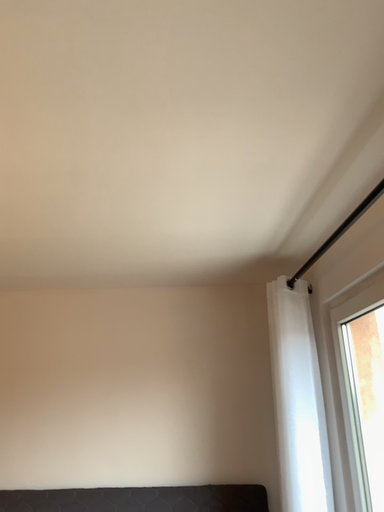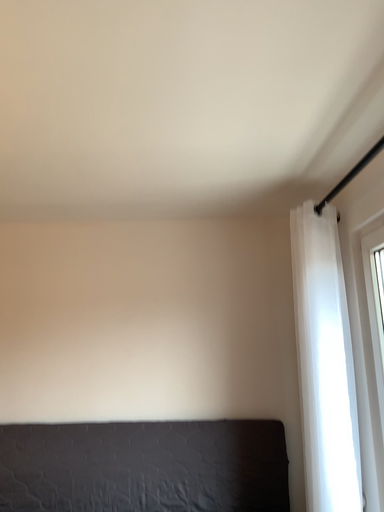
Question: How did the camera likely rotate when shooting the video?

Choices:
 (A) rotated upward
 (B) rotated downward

Answer: (B)